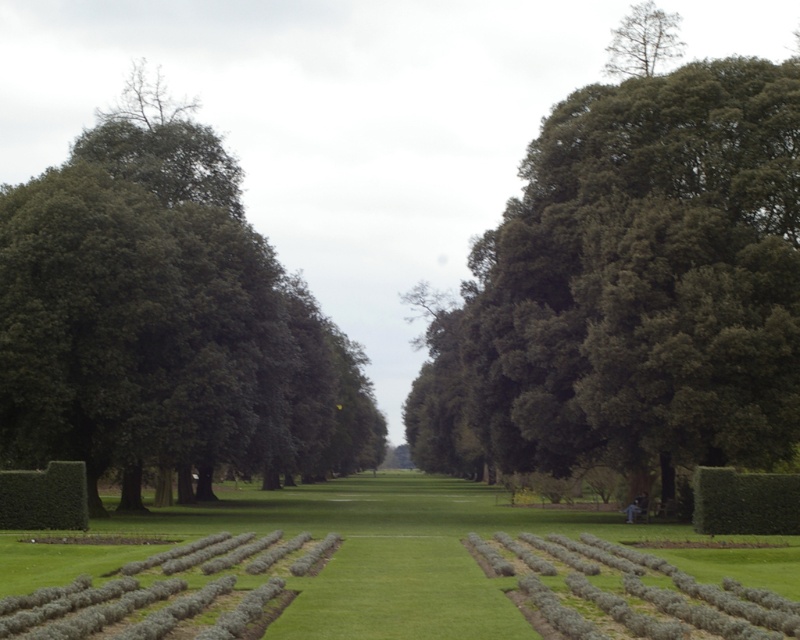
Between green shrubbery at lower left and green smooth hedge at center, which one is positioned higher?

green smooth hedge at center

The width and height of the screenshot is (800, 640). Describe the element at coordinates (382, 573) in the screenshot. I see `green shrubbery at lower left` at that location.

This screenshot has height=640, width=800. Describe the element at coordinates (382, 573) in the screenshot. I see `green shrubbery at lower left` at that location.

Identify the location of green shrubbery at lower left. (382, 573).

Does point (444, 362) come farther from viewer compared to point (28, 516)?

Yes, it is behind point (28, 516).

Who is positioned more to the right, green leafy tree at center or green leafy hedge at center?

green leafy tree at center is more to the right.

Who is more forward, (434, 323) or (84, 474)?

Point (84, 474)

The width and height of the screenshot is (800, 640). In order to click on green leafy tree at center in this screenshot , I will do `click(632, 282)`.

Who is shorter, green leafy tree at left or green shrubbery at lower left?

green shrubbery at lower left is shorter.

Between point (16, 374) and point (612, 561), which one is positioned in front?

Point (612, 561) is in front.

Is point (114, 147) more distant than point (494, 604)?

Yes, it is behind point (494, 604).

At what (x,y) coordinates should I click in order to perform the action: click on green leafy tree at left. Please return your answer as a coordinate pair (x, y). The height and width of the screenshot is (640, 800). Looking at the image, I should click on (164, 320).